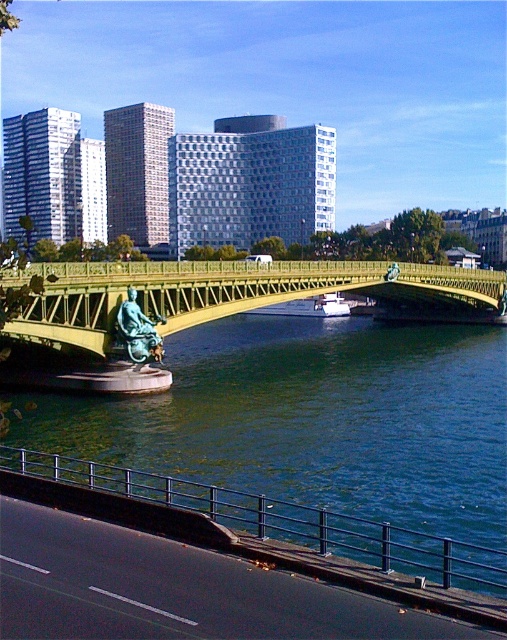
You are a drone operator trying to capture a photo of the metallic gold bridge at center from above. The drone has a GPS coordinate system where the bottom left corner of the image is the origin point. The bridge is located at coordinate point 0.458, 0.436. If the drone is currently at coordinate point 0.5, 0.5, which direction should you move the drone to align it with the bridge?

The metallic gold bridge at center is located at coordinate point (221,292). Since the drone is at (253,320), it needs to move slightly to the left and down to reach the bridge. Moving left decreases the x coordinate from 0.5 to 0.458, and moving down decreases the y coordinate from 0.5 to 0.436.

You are standing on the bank of the river and want to cross to the other side. The metallic gold bridge at center is 100 feet long. The white glossy boat at center is anchored 59.73 feet away from the bridge. If you start at the bank closest to the bridge, which option allows you to reach the other side faster? Option A is taking the bridge, and Option B is taking the boat. Assume the boat can move at 5 feet per second and walking on the bridge is 3 feet per second.

Taking the bridge would be faster. The bridge is 100 feet long, so walking across at 3 feet per second would take approximately 33.3 seconds. The boat is 59.73 feet away from the bridge, so rowing at 5 feet per second would take about 11.95 seconds. However, since the boat is anchored at the center, you would need to row to the other side, which is double the distance, totaling 119.46 feet. Rowing that distance would take 23.89 seconds. Therefore, the bridge remains faster at 33.3 seconds compared to 23.89?